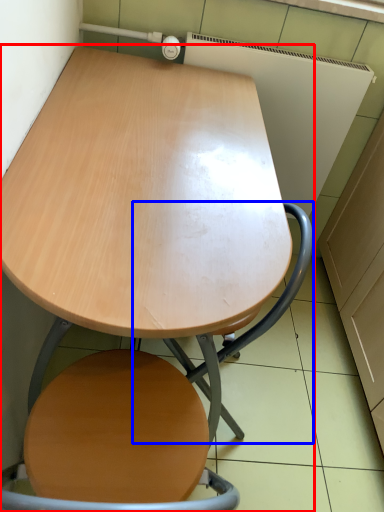
Question: Which object appears closest to the camera in this image, table (highlighted by a red box) or swivel chair (highlighted by a blue box)?

Choices:
 (A) table
 (B) swivel chair

Answer: (A)